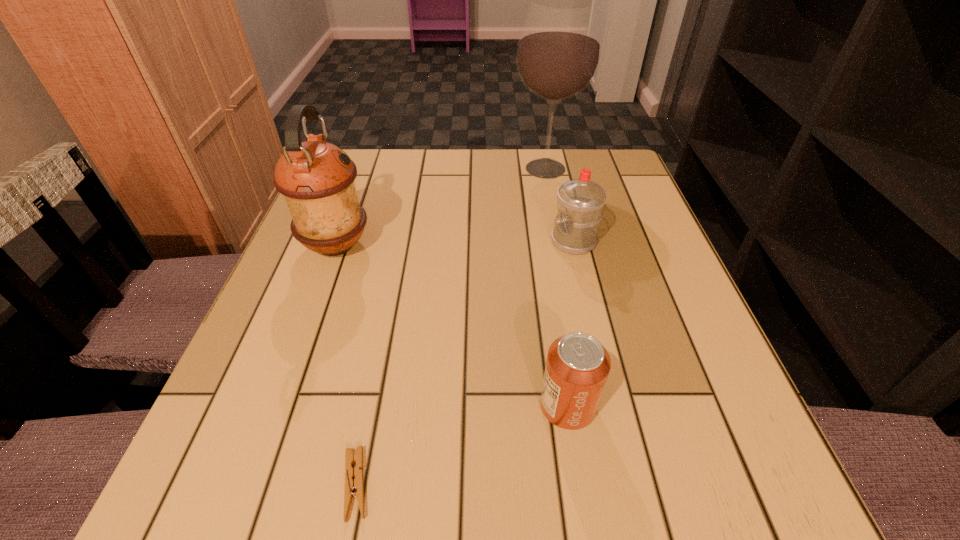
The height and width of the screenshot is (540, 960). Find the location of `vacant space located on the back of the oil lamp`. vacant space located on the back of the oil lamp is located at coordinates (364, 170).

Locate an element on the screen. free location located on the handle side of the third tallest object is located at coordinates (391, 241).

You are a GUI agent. You are given a task and a screenshot of the screen. Output one action in this format:
    pyautogui.click(x=<x>, y=<y>)
    Task: Click on the vacant space located 0.290m on the handle side of the third tallest object
    
    Given the screenshot: What is the action you would take?
    pyautogui.click(x=414, y=241)

In order to click on free space located 0.270m on the handle side of the third tallest object in this screenshot , I will do `click(423, 241)`.

Image resolution: width=960 pixels, height=540 pixels. In order to click on vacant area located on the back of the fourth farthest object in this screenshot , I will do coord(540,237).

Where is `vacant point located 0.100m on the left of the clothespin`? vacant point located 0.100m on the left of the clothespin is located at coordinates (264, 484).

Identify the location of object that is at the far edge. Image resolution: width=960 pixels, height=540 pixels. (559, 50).

Find the location of `object that is at the near edge`. object that is at the near edge is located at coordinates (357, 485).

Find the location of `object present at the left edge`. object present at the left edge is located at coordinates (316, 178).

Where is `alcohol at the right edge`? alcohol at the right edge is located at coordinates (559, 50).